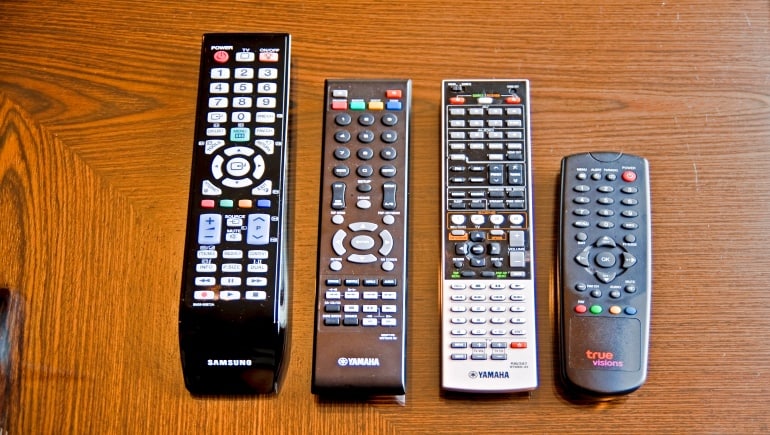
This screenshot has height=435, width=770. In order to click on gray yamaha remote control in this screenshot , I will do `click(360, 359)`.